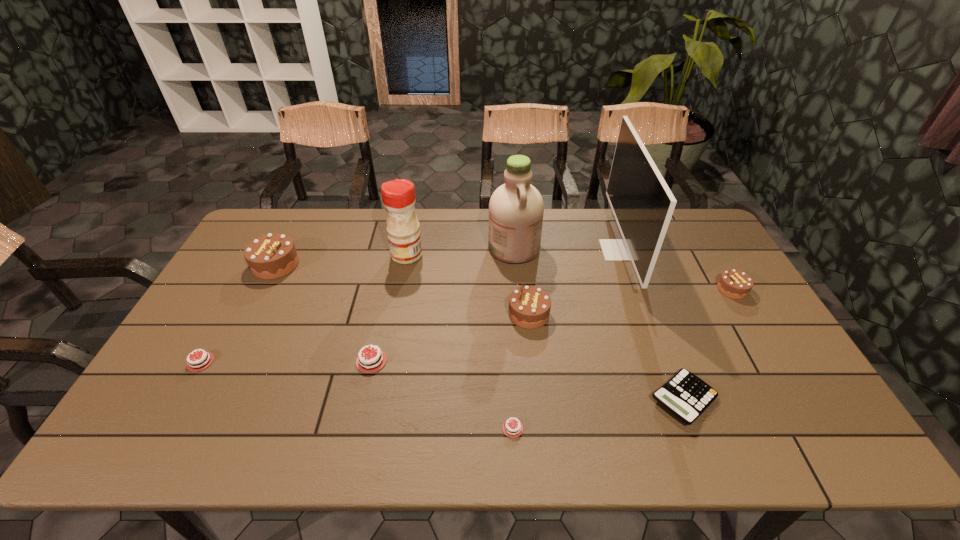
Identify the location of free space between the calculator and the black monitor. (651, 325).

Find the location of a particular element. This screenshot has height=540, width=960. vacant space that's between the shortest object and the third tallest chocolate cake is located at coordinates (622, 359).

At what (x,y) coordinates should I click in order to perform the action: click on vacant area that lies between the cleansing agent and the nearest chocolate cake. Please return your answer as a coordinate pair (x, y). This screenshot has width=960, height=540. Looking at the image, I should click on (514, 338).

I want to click on the seventh closest object to the second brown chocolate cake from right to left, so click(734, 284).

Choose which object is the sixth nearest neighbor to the nearest red chocolate cake. Please provide its 2D coordinates. Your answer should be formatted as a tuple, i.e. [(x, y)], where the tuple contains the x and y coordinates of a point satisfying the conditions above.

[(403, 228)]

Locate an element on the screen. This screenshot has width=960, height=540. chocolate cake that stands as the fourth closest to the rightmost chocolate cake is located at coordinates (271, 256).

Where is `chocolate cake that is the third closest to the rightmost brown chocolate cake`? This screenshot has height=540, width=960. chocolate cake that is the third closest to the rightmost brown chocolate cake is located at coordinates (368, 362).

What are the coordinates of `the closest brown chocolate cake relative to the second red chocolate cake from left to right` in the screenshot? It's located at (529, 306).

What are the coordinates of `brown chocolate cake that can be found as the second closest to the eighth shortest object` in the screenshot? It's located at (529, 306).

Where is `the closest red chocolate cake to the red condiment`? This screenshot has height=540, width=960. the closest red chocolate cake to the red condiment is located at coordinates (368, 362).